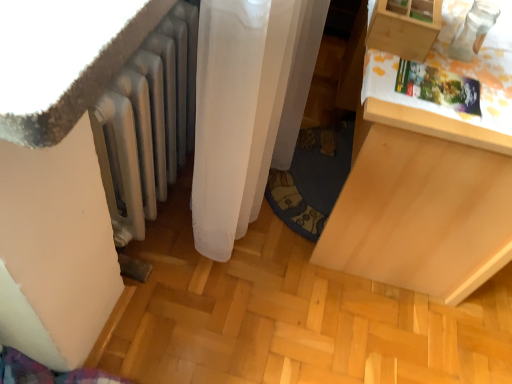
Question: Looking at their shapes, would you say light wood drawer at right is wider or thinner than silver metallic radiator at lower left?

Choices:
 (A) wide
 (B) thin

Answer: (A)

Question: From a real-world perspective, is light wood drawer at right positioned above or below silver metallic radiator at lower left?

Choices:
 (A) below
 (B) above

Answer: (A)

Question: Which object is the closest to the silver metallic radiator at lower left?

Choices:
 (A) light wood drawer at right
 (B) wooden drawer at upper right

Answer: (B)

Question: Estimate the real-world distances between objects in this image. Which object is closer to the silver metallic radiator at lower left?

Choices:
 (A) light wood drawer at right
 (B) wooden drawer at upper right

Answer: (B)